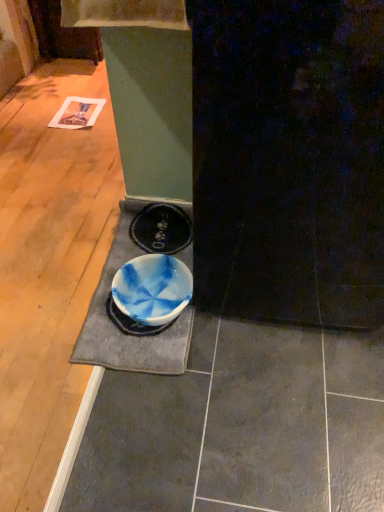
At what (x,y) coordinates should I click in order to perform the action: click on vacant space situated on the left part of blue marbled doormat at center. Please return your answer as a coordinate pair (x, y). Looking at the image, I should click on (48, 279).